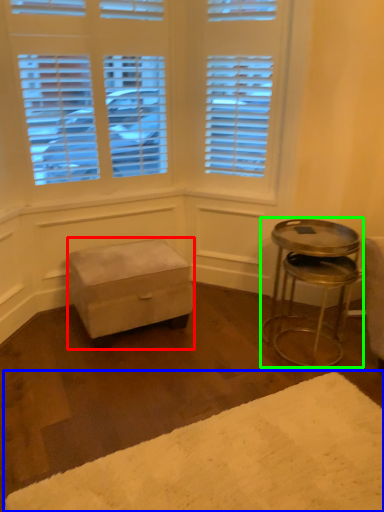
Question: Considering the real-world distances, which object is farthest from stool (highlighted by a red box)? plain (highlighted by a blue box) or table (highlighted by a green box)?

Choices:
 (A) plain
 (B) table

Answer: (A)